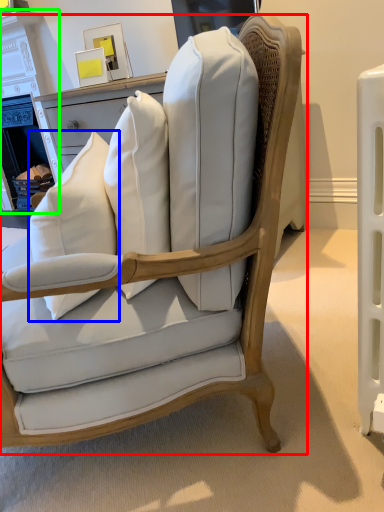
Question: Which object is positioned farthest from chair (highlighted by a red box)? Select from throw pillow (highlighted by a blue box) and fireplace (highlighted by a green box).

Choices:
 (A) throw pillow
 (B) fireplace

Answer: (B)